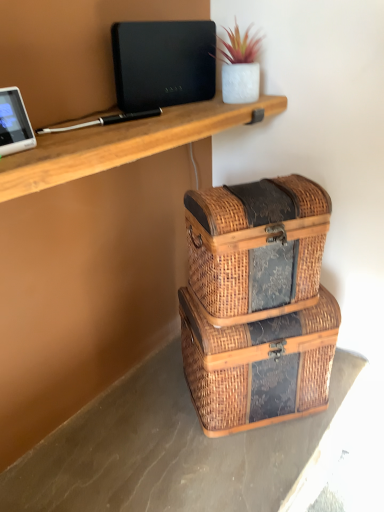
Locate an element on the screen. This screenshot has width=384, height=512. vacant region above brown wicker baskets at lower right (from a real-world perspective) is located at coordinates tap(170, 445).